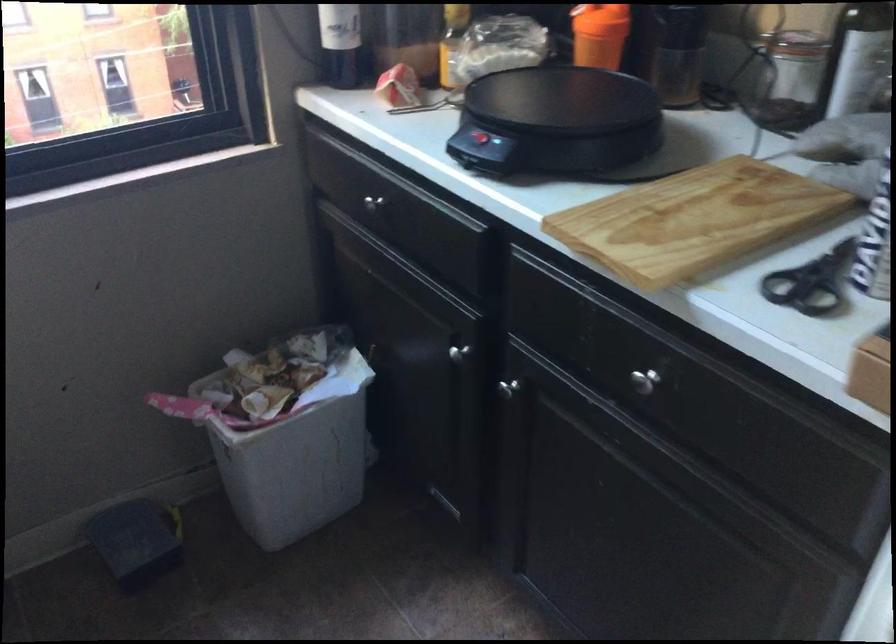
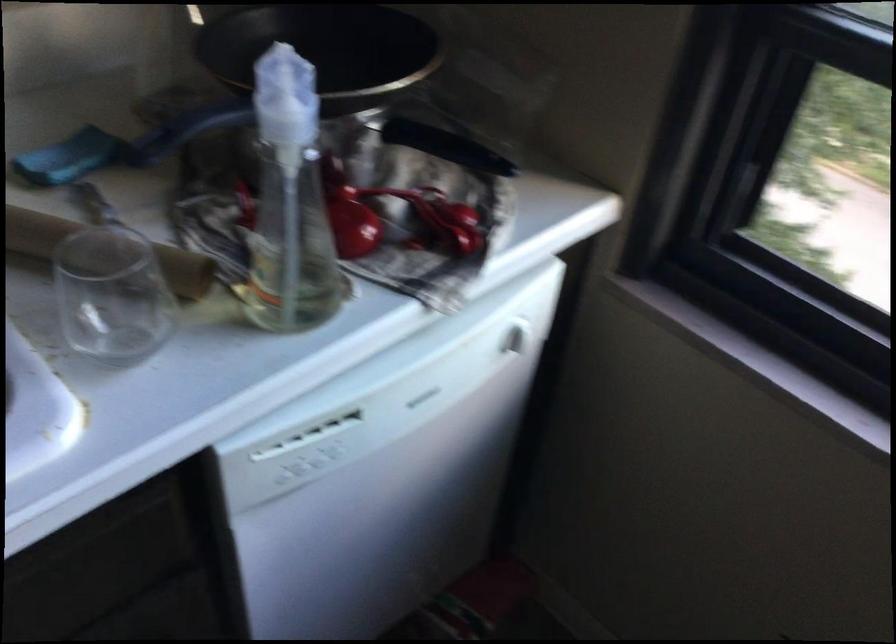
The images are taken continuously from a first-person perspective. In which direction is your viewpoint rotating?

The camera rotated toward left-down.